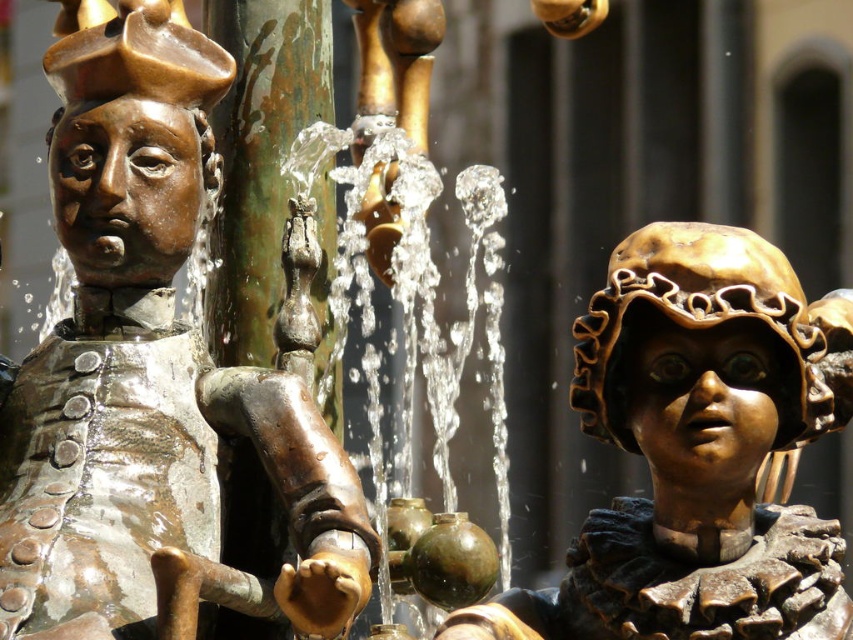
You are a photographer standing at the camera position. You want to capture a closeup shot of the bronze statue at center. Given that your camera has a maximum zoom range of 100 meters, can you get a clear closeup without moving closer?

The bronze statue at center is 54.37 meters away from the camera. Since the camera can zoom up to 100 meters, it can effectively capture a clear closeup of the bronze statue at center without needing to move closer.